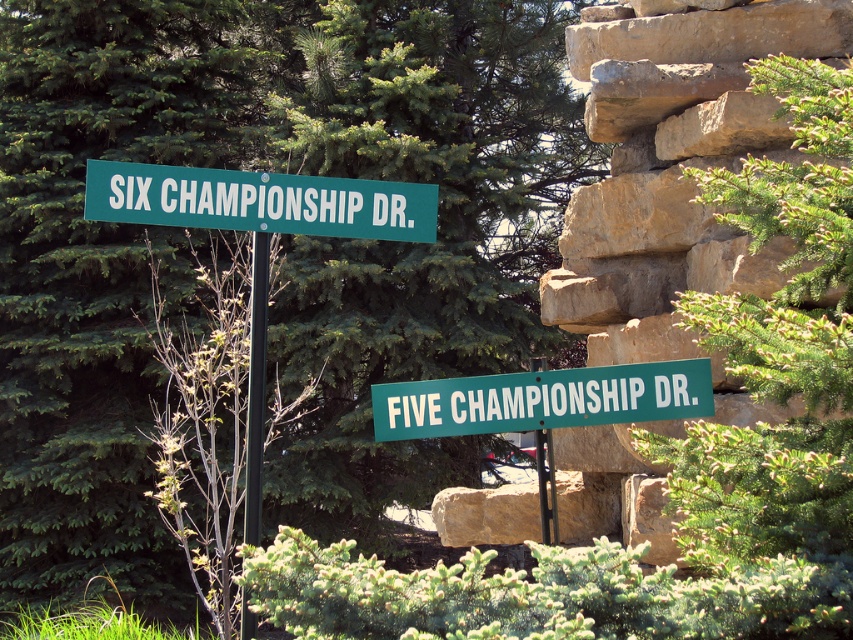
You are a delivery driver approaching the green plastic pole at center with a green plastic street sign at center attached to it. You need to read the sign to navigate. Which object should you look at first to see the street name?

The green plastic street sign at center is in front of the green plastic pole at center, so you should look at the green plastic street sign at center first to see the street name.

You are a delivery driver who needs to navigate through a narrow alley. You see a green leafy tree at upper center and a green plastic street sign at upper center. Which object is taller and could potentially block your view ahead?

The green leafy tree at upper center is much taller than the green plastic street sign at upper center, so it could potentially block your view ahead.